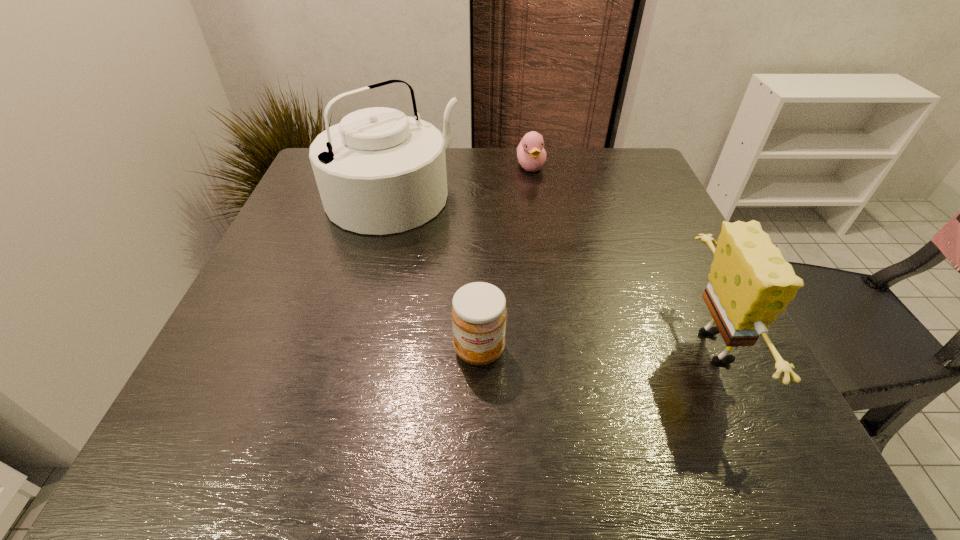
The image size is (960, 540). Find the location of `the third object from right to left`. the third object from right to left is located at coordinates (479, 313).

This screenshot has width=960, height=540. I want to click on the rightmost object, so click(x=750, y=283).

Locate an element on the screen. sponge is located at coordinates (750, 283).

The image size is (960, 540). In order to click on the shortest object in this screenshot , I will do `click(531, 154)`.

In order to click on the second object from right to left in this screenshot , I will do (x=531, y=154).

Find the location of a particular element. The height and width of the screenshot is (540, 960). the leftmost object is located at coordinates (378, 171).

Where is `kettle`? kettle is located at coordinates (378, 171).

This screenshot has width=960, height=540. Identify the location of vacant region located 0.330m on the front-facing side of the duckling. (570, 264).

Image resolution: width=960 pixels, height=540 pixels. What are the coordinates of `blank space located on the front-facing side of the duckling` in the screenshot? It's located at (550, 215).

You are a GUI agent. You are given a task and a screenshot of the screen. Output one action in this format:
    pyautogui.click(x=<x>, y=<y>)
    Task: Click on the vacant position located on the front-facing side of the duckling
    The image size is (960, 540).
    Given the screenshot: What is the action you would take?
    pyautogui.click(x=560, y=239)